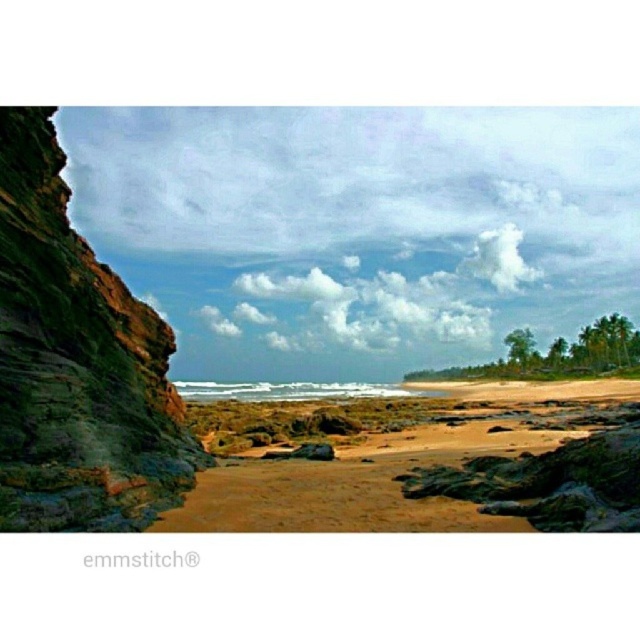
Consider the image. You are standing on the green mossy rock at left and want to walk to the brown sandy beach at center. Which direction should you move towards?

You should move towards the right to reach the brown sandy beach at center because the green mossy rock at left is positioned on the left side of it.